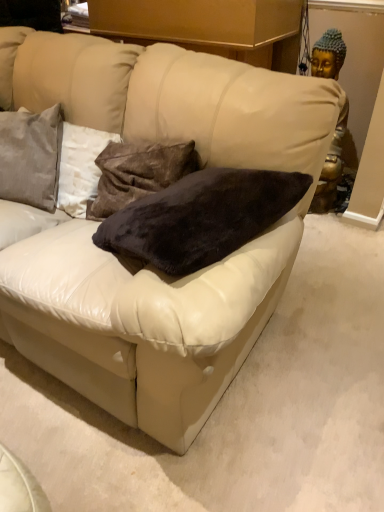
Question: Considering the positions of velvety brown pillow at center, which appears as the second pillow when viewed from the left, and satin gray pillow at upper left, which is counted as the second pillow, starting from the right, in the image, is velvety brown pillow at center, which appears as the second pillow when viewed from the left, taller or shorter than satin gray pillow at upper left, which is counted as the second pillow, starting from the right,?

Choices:
 (A) tall
 (B) short

Answer: (A)

Question: In the image, is velvety brown pillow at center, marked as the first pillow in a right-to-left arrangement, on the left side or the right side of satin gray pillow at upper left, placed as the first pillow when sorted from left to right?

Choices:
 (A) left
 (B) right

Answer: (B)

Question: From the image's perspective, is velvety brown pillow at center, marked as the first pillow in a right-to-left arrangement, located above or below satin gray pillow at upper left, which is counted as the second pillow, starting from the right?

Choices:
 (A) above
 (B) below

Answer: (B)

Question: From their relative heights in the image, would you say satin gray pillow at upper left, placed as the first pillow when sorted from left to right, is taller or shorter than velvety brown pillow at center, marked as the first pillow in a right-to-left arrangement?

Choices:
 (A) short
 (B) tall

Answer: (A)

Question: Is satin gray pillow at upper left, which is counted as the second pillow, starting from the right, in front of or behind velvety brown pillow at center, which appears as the second pillow when viewed from the left, in the image?

Choices:
 (A) front
 (B) behind

Answer: (B)

Question: Looking at their shapes, would you say satin gray pillow at upper left, placed as the first pillow when sorted from left to right, is wider or thinner than velvety brown pillow at center, marked as the first pillow in a right-to-left arrangement?

Choices:
 (A) thin
 (B) wide

Answer: (B)

Question: Considering the positions of satin gray pillow at upper left, which is counted as the second pillow, starting from the right, and velvety brown pillow at center, marked as the first pillow in a right-to-left arrangement, in the image, is satin gray pillow at upper left, which is counted as the second pillow, starting from the right, bigger or smaller than velvety brown pillow at center, marked as the first pillow in a right-to-left arrangement,?

Choices:
 (A) small
 (B) big

Answer: (B)